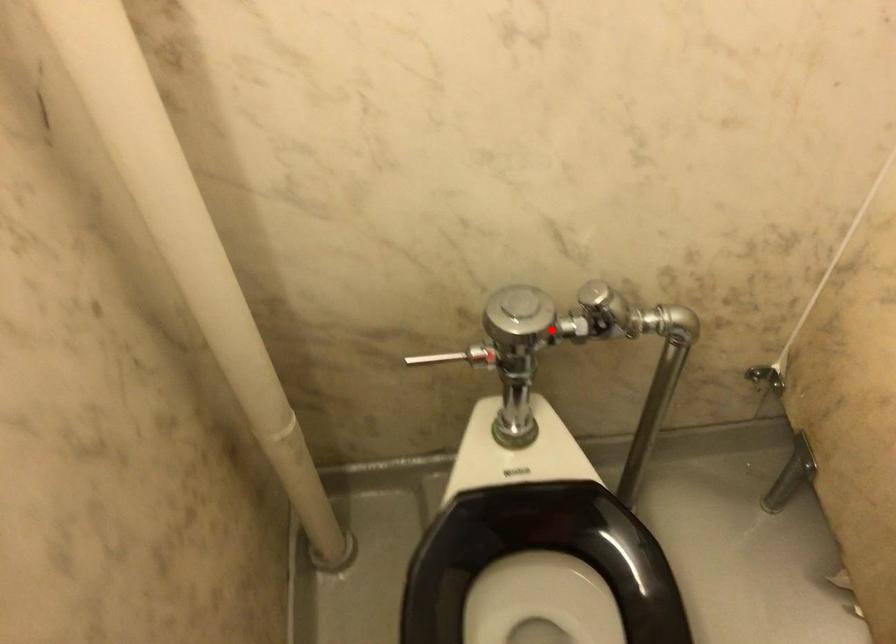
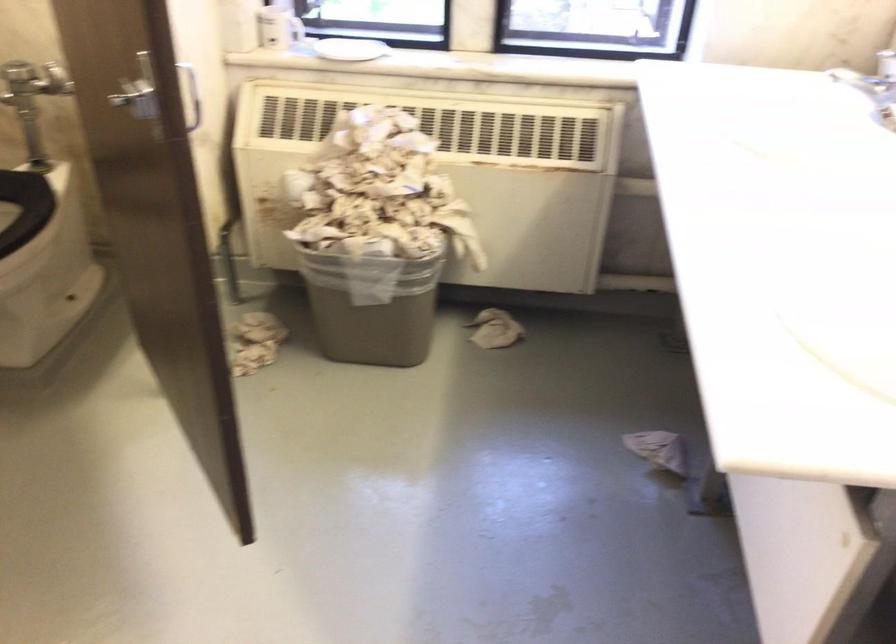
Find the pixel in the second image that matches the highlighted location in the first image.

(32, 80)